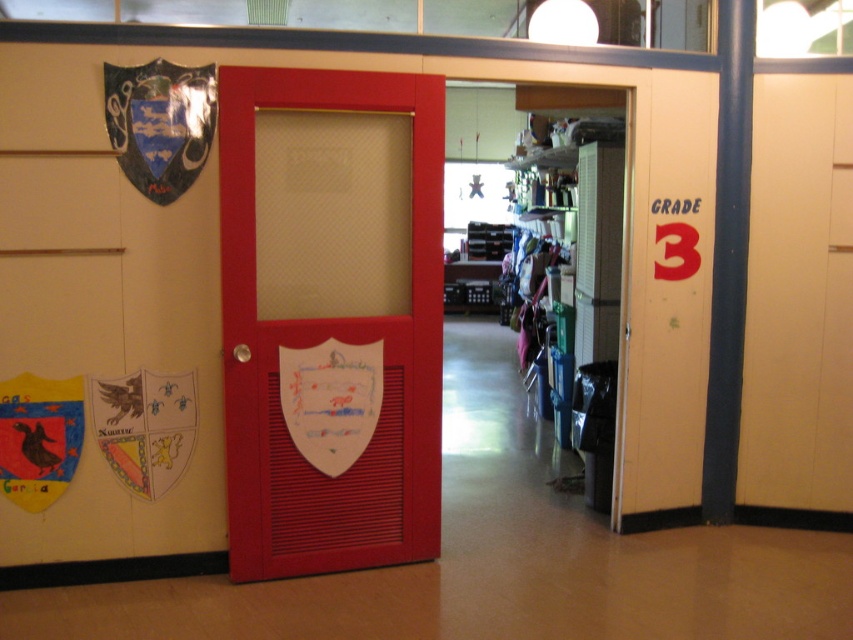
You are a painter assigned to paint the matte wood door at center and the shiny metallic shield at upper left. You have a ladder that can reach up to 2 meters. The door is 2.2 meters tall. Can you paint both objects without needing a taller ladder?

The matte wood door at center is taller than the shiny metallic shield at upper left. Since the door is 2.2 meters tall, which exceeds the ladder height of 2 meters, you cannot paint the entire door. However, the shield is shorter than the door, so you can paint the shiny metallic shield at upper left but not the entire matte wood door at center with the current ladder.

You are a maintenance worker who needs to access the shiny metallic shield at upper left. The matte wood door at center is blocking your path. Can you reach the shield without moving the door?

The matte wood door at center is in front of the shiny metallic shield at upper left, so you cannot reach the shield without moving the door.